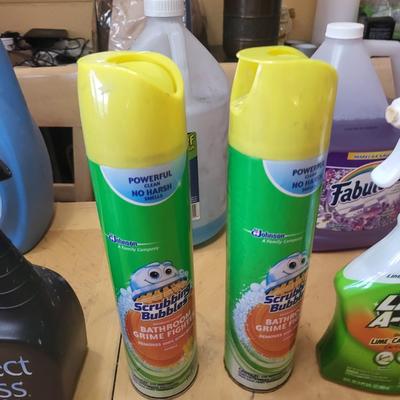
Find the location of a particular element. Image resolution: width=400 pixels, height=400 pixels. black spray bottle is located at coordinates (63, 324).